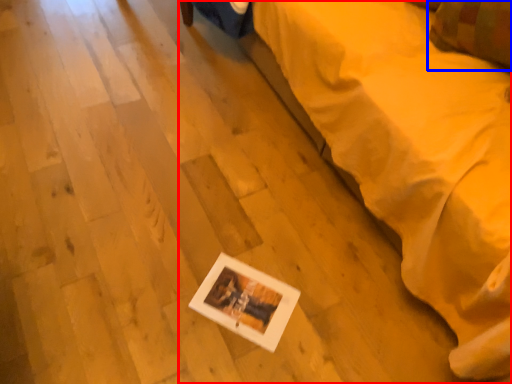
Question: Among these objects, which one is farthest to the camera, furniture (highlighted by a red box) or pillow (highlighted by a blue box)?

Choices:
 (A) furniture
 (B) pillow

Answer: (B)